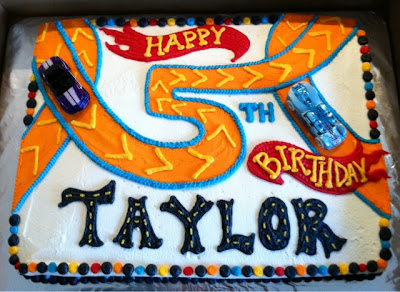
The width and height of the screenshot is (400, 292). I want to click on platter, so click(9, 283).